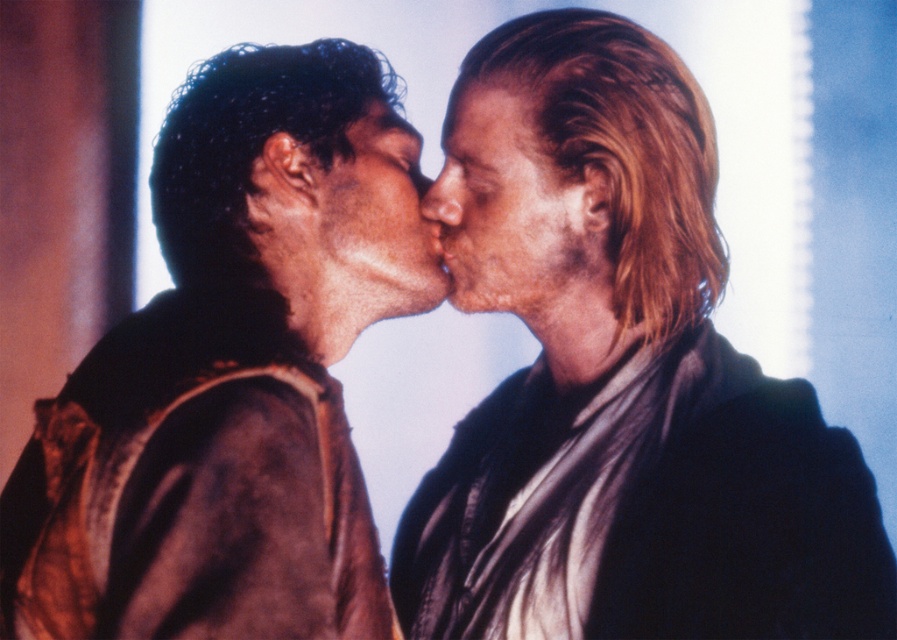
You are a photographer standing in front of the scene. You want to take a photo focusing on the smooth skin nose at center. However, the brown suede jacket at left is blocking your view. Can you move the jacket to get a clear shot?

The brown suede jacket at left is closer to the viewer than the smooth skin nose at center, so moving the jacket would allow you to get a clear shot of the smooth skin nose at center.

You are a photographer trying to capture the smooth skin face at center without the shiny black jacket at right reflecting in the background. Can you adjust your camera angle to achieve this?

The shiny black jacket at right is in front of the smooth skin face at center, so adjusting the camera angle might not hide the reflection since the jacket is closer to the camera than the face. You may need to physically move the shiny black jacket at right or use a different background.

You are a photographer trying to focus on two points in the image. The first point is at coordinates point (335, 602) and the second is at point (463, 200). Which point should you adjust your focus to if you want to capture the closest object to the camera?

Point (335, 602) is closer to the camera than point (463, 200), so you should focus on point (335, 602) to capture the closest object.